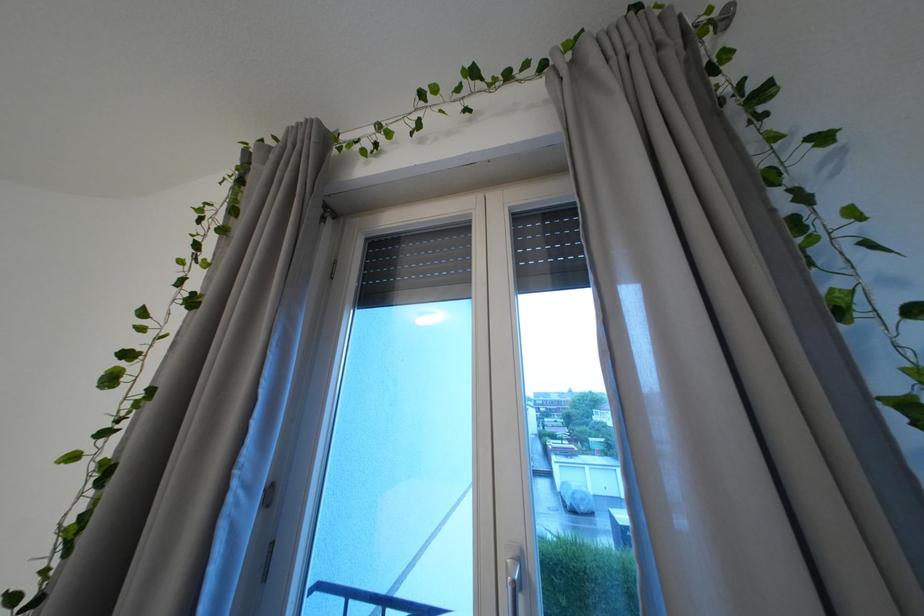
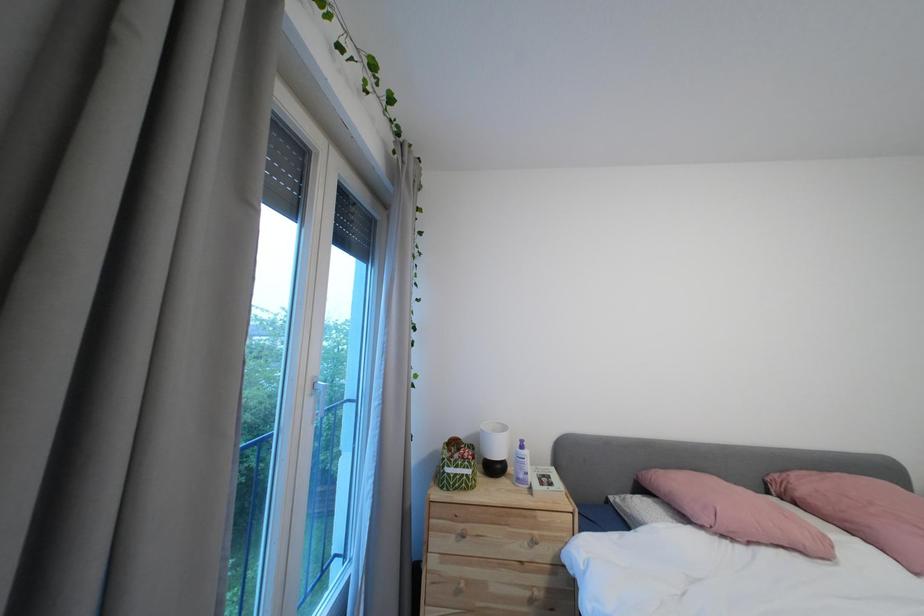
Question: Based on the continuous images, in which direction is the camera rotating? Reply with the corresponding letter.

Choices:
 (A) Left
 (B) Right
 (C) Up
 (D) Down

Answer: (B)